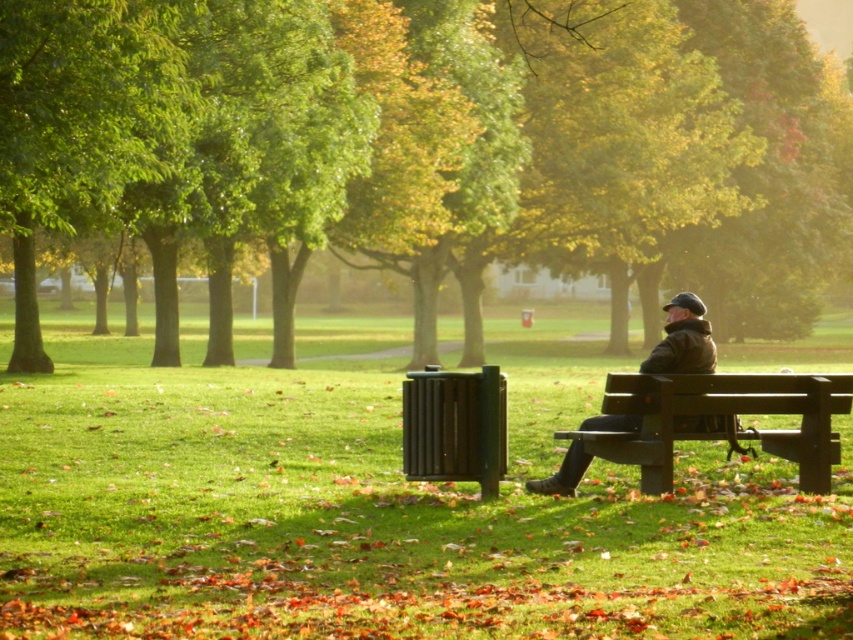
Question: Which point is closer to the camera?

Choices:
 (A) (659, 412)
 (B) (693, 314)

Answer: (A)

Question: In this image, where is wooden bench at right located relative to dark brown leather jacket at center?

Choices:
 (A) above
 (B) below

Answer: (B)

Question: Is wooden bench at right below dark brown leather jacket at center?

Choices:
 (A) no
 (B) yes

Answer: (B)

Question: Can you confirm if wooden bench at right is smaller than dark brown leather jacket at center?

Choices:
 (A) yes
 (B) no

Answer: (B)